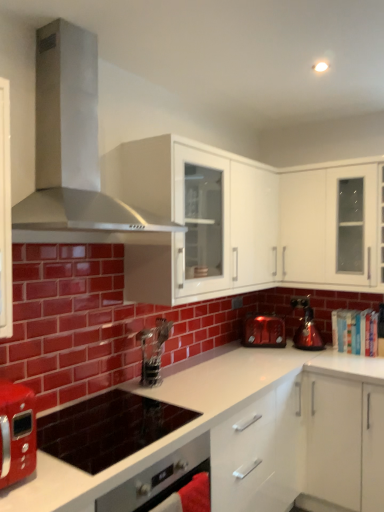
At what (x,y) coordinates should I click in order to perform the action: click on vacant space in white glossy cabinet at upper center, the 1th cabinetry viewed from the left (from a real-world perspective). Please return your answer as a coordinate pair (x, y). This screenshot has width=384, height=512. Looking at the image, I should click on (201, 370).